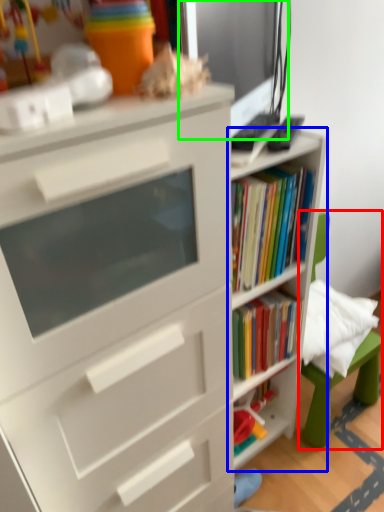
Question: Considering the real-world distances, which object is closest to swivel chair (highlighted by a red box)? shelf (highlighted by a blue box) or computer monitor (highlighted by a green box).

Choices:
 (A) shelf
 (B) computer monitor

Answer: (A)